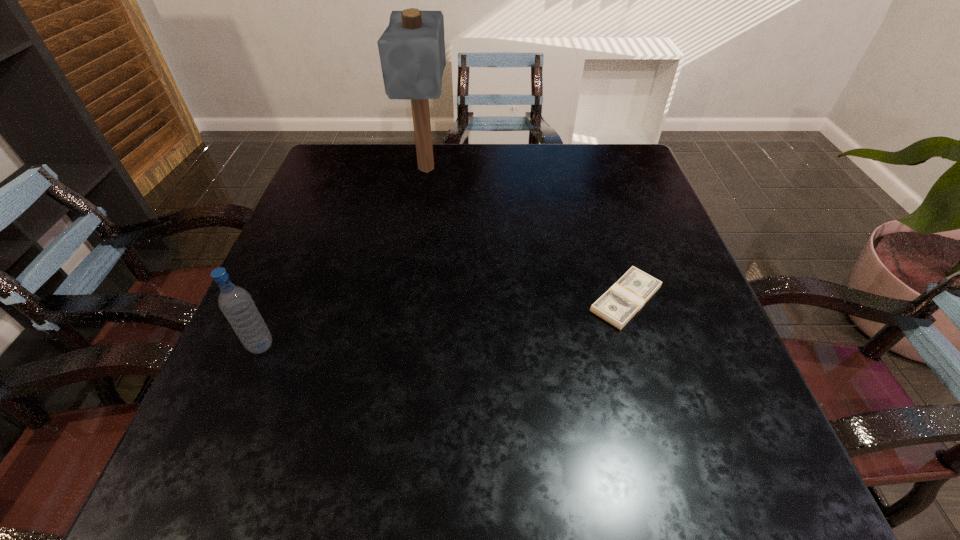
You are a GUI agent. You are given a task and a screenshot of the screen. Output one action in this format:
    pyautogui.click(x=<x>, y=<y>)
    Task: Click on the empty space between the second farthest object and the nearest object
    This screenshot has width=960, height=540.
    Given the screenshot: What is the action you would take?
    pyautogui.click(x=444, y=322)

Where is `vacant area that lies between the rightmost object and the second tallest object`? This screenshot has height=540, width=960. vacant area that lies between the rightmost object and the second tallest object is located at coordinates (444, 322).

At what (x,y) coordinates should I click in order to perform the action: click on free space between the second object from right to left and the shortest object. Please return your answer as a coordinate pair (x, y). Image resolution: width=960 pixels, height=540 pixels. Looking at the image, I should click on (526, 234).

This screenshot has width=960, height=540. I want to click on free space between the second object from left to right and the nearest object, so click(344, 258).

Where is `unoccupied area between the second object from right to left and the water bottle`? This screenshot has width=960, height=540. unoccupied area between the second object from right to left and the water bottle is located at coordinates (344, 258).

Where is `free spot between the farthest object and the water bottle`? The width and height of the screenshot is (960, 540). free spot between the farthest object and the water bottle is located at coordinates pos(344,258).

This screenshot has width=960, height=540. What are the coordinates of `vacant region between the leftmost object and the tallest object` in the screenshot? It's located at (344, 258).

Where is `free point between the second nearest object and the farthest object`? free point between the second nearest object and the farthest object is located at coordinates [x=526, y=234].

Where is `vacant area that lies between the leftmost object and the second farthest object`? The width and height of the screenshot is (960, 540). vacant area that lies between the leftmost object and the second farthest object is located at coordinates (444, 322).

This screenshot has width=960, height=540. Identify the location of empty space between the water bottle and the dollar. (444, 322).